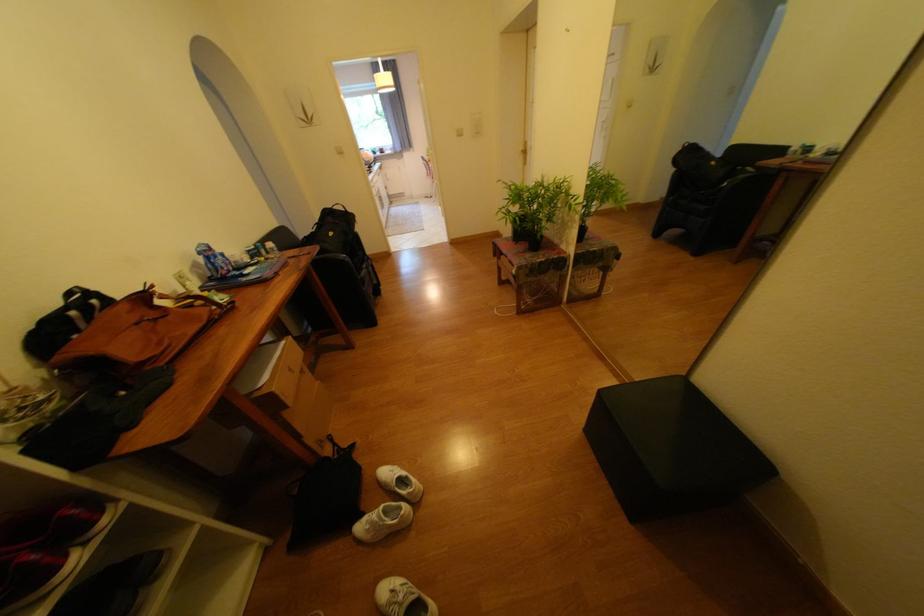
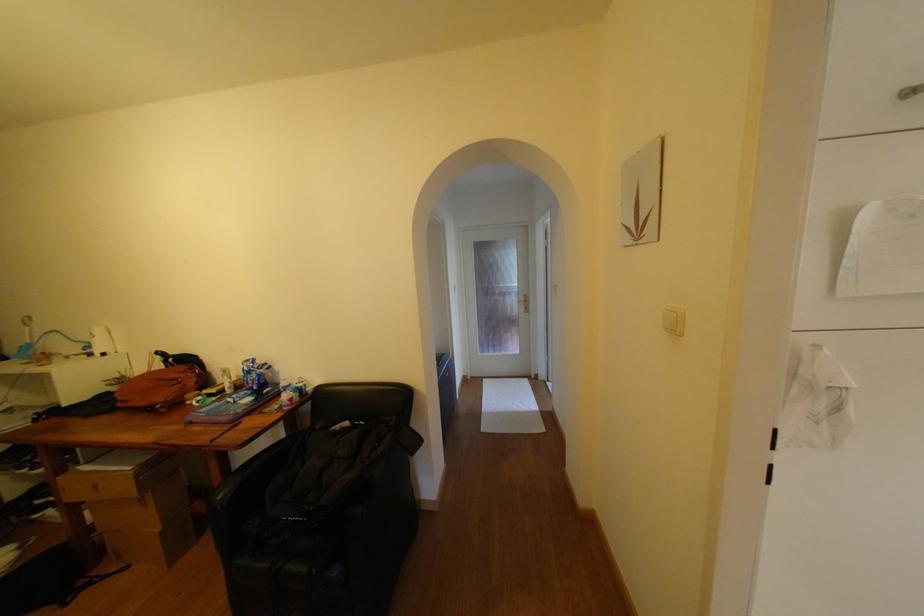
In the second image, find the point that corresponds to (131,307) in the first image.

(190, 369)